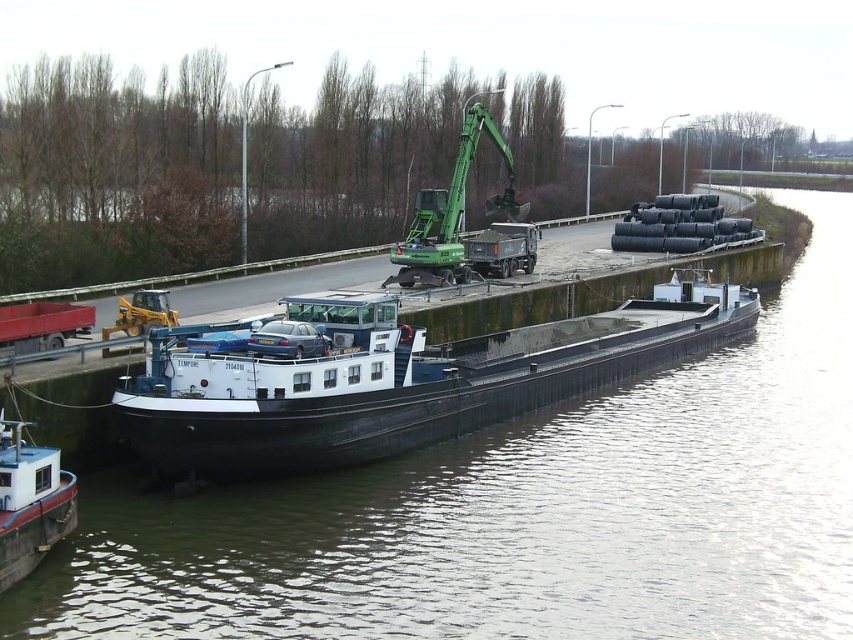
Question: Which object is positioned closest to the black matte barge at center?

Choices:
 (A) green metallic crane at center
 (B) black rubber tubes at upper center

Answer: (B)

Question: Which point appears closest to the camera in this image?

Choices:
 (A) pyautogui.click(x=234, y=566)
 (B) pyautogui.click(x=396, y=253)
 (C) pyautogui.click(x=260, y=438)

Answer: (A)

Question: Is the position of black rubber tubes at upper center less distant than that of green metallic crane at center?

Choices:
 (A) no
 (B) yes

Answer: (B)

Question: Which object is closer to the camera taking this photo?

Choices:
 (A) black matte barge at center
 (B) green metallic crane at center

Answer: (A)

Question: Is black rubber tubes at upper center below black matte barge at center?

Choices:
 (A) yes
 (B) no

Answer: (A)

Question: Can you confirm if black rubber tubes at upper center is positioned above black matte barge at center?

Choices:
 (A) yes
 (B) no

Answer: (B)